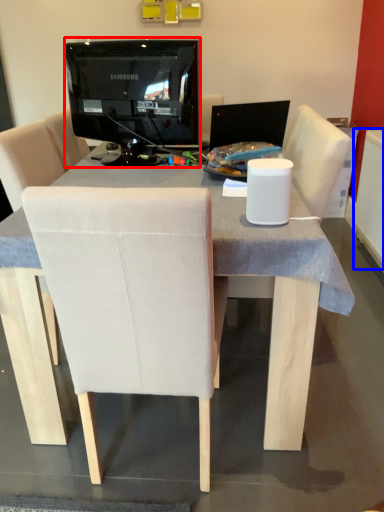
Question: Which object appears closest to the camera in this image, television (highlighted by a red box) or radiator (highlighted by a blue box)?

Choices:
 (A) television
 (B) radiator

Answer: (A)